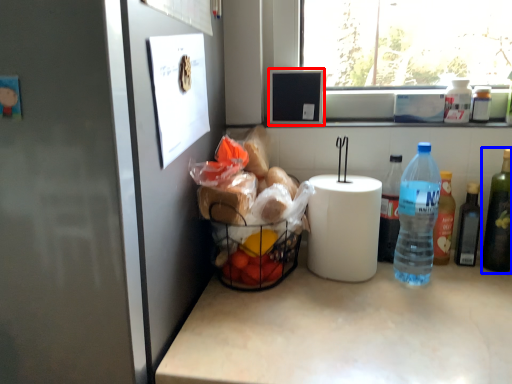
Question: Which point is further to the camera, appliance (highlighted by a red box) or bottle (highlighted by a blue box)?

Choices:
 (A) appliance
 (B) bottle

Answer: (A)